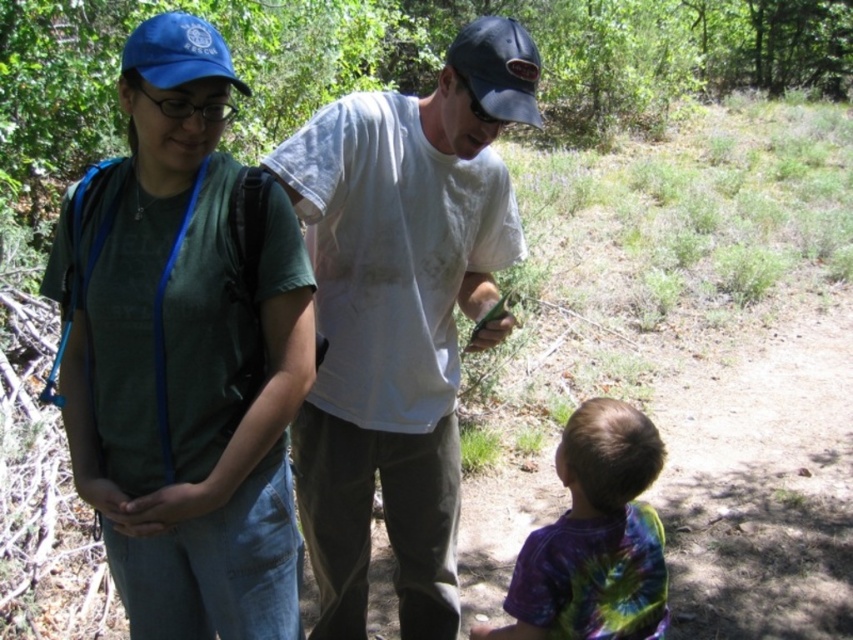
You are a photographer trying to capture a clear shot of both the white cotton shirt at center and the black matte baseball cap at upper center. Since you want both subjects to appear distinct in the photo, which one should you focus on first to ensure it appears sharp?

You should focus on the white cotton shirt at center first because it is larger in size than the black matte baseball cap at upper center, making it easier to capture clearly.